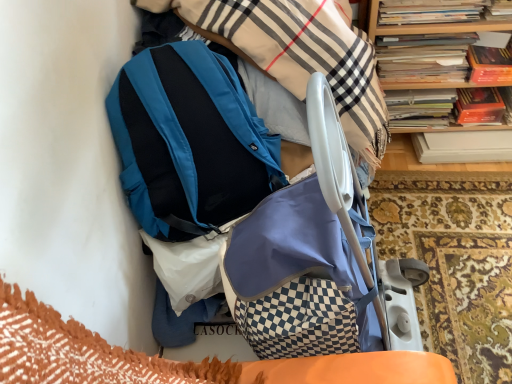
Describe the element at coordinates (429, 11) in the screenshot. I see `hardcover book at upper right, positioned as the 1th book in front-to-back order` at that location.

What do you see at coordinates (479, 106) in the screenshot? I see `hardcover book at upper right` at bounding box center [479, 106].

What is the approximate width of wooden bookcase at upper right?

wooden bookcase at upper right is 10.32 inches wide.

The image size is (512, 384). Describe the element at coordinates (315, 276) in the screenshot. I see `matte blue baby carriage at center` at that location.

Identify the location of hardcover book at upper right, positioned as the 1th book in front-to-back order. Image resolution: width=512 pixels, height=384 pixels. (429, 11).

Can you tell me how much matte blue baby carriage at center and hardcover book at upper right, positioned as the 1th book in front-to-back order, differ in facing direction?

They differ by 90.9 degrees in their facing directions.

Locate an element on the screen. The image size is (512, 384). book that is the 2nd object located above the matte blue baby carriage at center (from the image's perspective) is located at coordinates (429, 11).

Is matte blue baby carriage at center facing away from hardcover book at upper right, which ranks as the 2th book in back-to-front order?

No, matte blue baby carriage at center's orientation is not away from hardcover book at upper right, which ranks as the 2th book in back-to-front order.

Which of these two, matte blue baby carriage at center or hardcover book at upper right, which ranks as the 2th book in back-to-front order, is bigger?

matte blue baby carriage at center is bigger.

In the image, is teal matte backpack at upper center on the left side or the right side of wooden bookcase at upper right?

From the image, it's evident that teal matte backpack at upper center is to the left of wooden bookcase at upper right.

Is teal matte backpack at upper center wider than wooden bookcase at upper right?

Indeed, teal matte backpack at upper center has a greater width compared to wooden bookcase at upper right.

Would you consider teal matte backpack at upper center to be distant from wooden bookcase at upper right?

No, teal matte backpack at upper center is not far away from wooden bookcase at upper right.

How many degrees apart are the facing directions of teal matte backpack at upper center and wooden bookcase at upper right?

There is a 87.7-degree angle between the facing directions of teal matte backpack at upper center and wooden bookcase at upper right.

From a real-world perspective, relative to matte blue baby carriage at center, is hardcover books at upper right, which is the first book from back to front, vertically above or below?

Clearly, from a real-world perspective, hardcover books at upper right, which is the first book from back to front, is below matte blue baby carriage at center.

Can you confirm if hardcover books at upper right, which is the first book from back to front, is thinner than matte blue baby carriage at center?

Indeed, hardcover books at upper right, which is the first book from back to front, has a lesser width compared to matte blue baby carriage at center.

Is hardcover books at upper right, placed as the 2th book when sorted from front to back, to the left or to the right of matte blue baby carriage at center in the image?

hardcover books at upper right, placed as the 2th book when sorted from front to back, is to the right of matte blue baby carriage at center.

Looking at this image, relative to wooden bookcase at upper right, is hardcover books at upper right, placed as the 2th book when sorted from front to back, in front or behind?

hardcover books at upper right, placed as the 2th book when sorted from front to back, is positioned farther from the viewer than wooden bookcase at upper right.

From the image's perspective, does hardcover books at upper right, which is the first book from back to front, appear lower than wooden bookcase at upper right?

Actually, hardcover books at upper right, which is the first book from back to front, appears above wooden bookcase at upper right in the image.

Is hardcover books at upper right, which is the first book from back to front, with wooden bookcase at upper right?

Yes, hardcover books at upper right, which is the first book from back to front, is beside wooden bookcase at upper right.

Is hardcover books at upper right, which is the first book from back to front, bigger than wooden bookcase at upper right?

No, hardcover books at upper right, which is the first book from back to front, is not bigger than wooden bookcase at upper right.

Is point (213, 168) farther from viewer compared to point (409, 55)?

No.

Which of these two, matte blue baby carriage at center or hardcover books at upper right, placed as the 2th book when sorted from front to back, stands taller?

Standing taller between the two is matte blue baby carriage at center.

Which object is further away from the camera, matte blue baby carriage at center or hardcover books at upper right, placed as the 2th book when sorted from front to back?

hardcover books at upper right, placed as the 2th book when sorted from front to back, is further away from the camera.

Is matte blue baby carriage at center to the left of hardcover books at upper right, placed as the 2th book when sorted from front to back, from the viewer's perspective?

Yes.

Considering the sizes of objects hardcover book at upper right, which ranks as the 2th book in back-to-front order, and wooden bookcase at upper right in the image provided, who is bigger, hardcover book at upper right, which ranks as the 2th book in back-to-front order, or wooden bookcase at upper right?

Bigger between the two is wooden bookcase at upper right.

Choose the correct answer: Is hardcover book at upper right, positioned as the 1th book in front-to-back order, inside wooden bookcase at upper right or outside it?

hardcover book at upper right, positioned as the 1th book in front-to-back order, is inside wooden bookcase at upper right.

Find the location of a particular element. the 2nd book counting from the left of the wooden bookcase at upper right is located at coordinates 429,11.

Does hardcover book at upper right, which ranks as the 2th book in back-to-front order, lie in front of wooden bookcase at upper right?

No, the depth of hardcover book at upper right, which ranks as the 2th book in back-to-front order, is greater than that of wooden bookcase at upper right.

Where is `backpack located above the matte blue baby carriage at center (from a real-world perspective)`? The height and width of the screenshot is (384, 512). backpack located above the matte blue baby carriage at center (from a real-world perspective) is located at coordinates (189, 141).

What's the angular difference between matte blue baby carriage at center and teal matte backpack at upper center's facing directions?

The angular difference between matte blue baby carriage at center and teal matte backpack at upper center is 3.84 degrees.

Would you say matte blue baby carriage at center is inside or outside teal matte backpack at upper center?

matte blue baby carriage at center is not enclosed by teal matte backpack at upper center.

Considering the relative positions of matte blue baby carriage at center and teal matte backpack at upper center in the image provided, is matte blue baby carriage at center to the left or to the right of teal matte backpack at upper center?

matte blue baby carriage at center is to the right of teal matte backpack at upper center.

Locate an element on the screen. The image size is (512, 384). baby carriage in front of the hardcover book at upper right, which ranks as the 2th book in back-to-front order is located at coordinates (315, 276).

Where is `backpack located below the wooden bookcase at upper right (from the image's perspective)`? backpack located below the wooden bookcase at upper right (from the image's perspective) is located at coordinates (189, 141).

From the image, which object appears to be nearer to hardcover book at upper right, wooden bookcase at upper right or hardcover book at upper right, which ranks as the 2th book in back-to-front order?

Based on the image, wooden bookcase at upper right appears to be nearer to hardcover book at upper right.

When comparing their distances from hardcover book at upper right, does matte blue baby carriage at center or hardcover books at upper right, placed as the 2th book when sorted from front to back, seem further?

matte blue baby carriage at center lies further to hardcover book at upper right than the other object.

Considering their positions, is hardcover book at upper right positioned further to matte blue baby carriage at center than hardcover books at upper right, placed as the 2th book when sorted from front to back?

The object further to matte blue baby carriage at center is hardcover book at upper right.

Based on their spatial positions, is hardcover book at upper right, which ranks as the 2th book in back-to-front order, or hardcover books at upper right, which is the first book from back to front, closer to matte blue baby carriage at center?

Based on the image, hardcover books at upper right, which is the first book from back to front, appears to be nearer to matte blue baby carriage at center.

From the image, which object appears to be nearer to teal matte backpack at upper center, wooden bookcase at upper right or hardcover book at upper right, which ranks as the 2th book in back-to-front order?

Based on the image, wooden bookcase at upper right appears to be nearer to teal matte backpack at upper center.

Looking at the image, which one is located closer to hardcover book at upper right, which ranks as the 2th book in back-to-front order, matte blue baby carriage at center or wooden bookcase at upper right?

wooden bookcase at upper right lies closer to hardcover book at upper right, which ranks as the 2th book in back-to-front order, than the other object.

Which object lies nearer to the anchor point hardcover book at upper right, which ranks as the 2th book in back-to-front order, teal matte backpack at upper center or matte blue baby carriage at center?

teal matte backpack at upper center.

Considering their positions, is teal matte backpack at upper center positioned closer to hardcover books at upper right, placed as the 2th book when sorted from front to back, than hardcover book at upper right?

The object closer to hardcover books at upper right, placed as the 2th book when sorted from front to back, is hardcover book at upper right.

The height and width of the screenshot is (384, 512). What are the coordinates of `bookcase between matte blue baby carriage at center and hardcover books at upper right, placed as the 2th book when sorted from front to back, along the z-axis` in the screenshot? It's located at (429, 26).

This screenshot has width=512, height=384. Identify the location of book between hardcover book at upper right, which ranks as the 2th book in back-to-front order, and wooden bookcase at upper right, in the horizontal direction. (424, 57).

At what (x,y) coordinates should I click in order to perform the action: click on book between teal matte backpack at upper center and hardcover books at upper right, which is the first book from back to front, in the horizontal direction. Please return your answer as a coordinate pair (x, y). The height and width of the screenshot is (384, 512). Looking at the image, I should click on (429, 11).

This screenshot has width=512, height=384. What are the coordinates of `bookcase between matte blue baby carriage at center and hardcover book at upper right, which ranks as the 2th book in back-to-front order, in the front-back direction` in the screenshot? It's located at (429, 26).